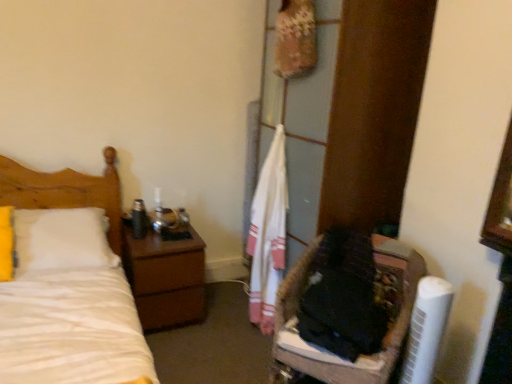
Question: From a real-world perspective, does brown wood nightstand at left sit lower than white matte bed at left?

Choices:
 (A) yes
 (B) no

Answer: (A)

Question: Are brown wood nightstand at left and white matte bed at left located far from each other?

Choices:
 (A) no
 (B) yes

Answer: (A)

Question: Can you confirm if brown wood nightstand at left is smaller than white matte bed at left?

Choices:
 (A) yes
 (B) no

Answer: (A)

Question: Is brown wood nightstand at left taller than white matte bed at left?

Choices:
 (A) yes
 (B) no

Answer: (B)

Question: From a real-world perspective, is brown wood nightstand at left over white matte bed at left?

Choices:
 (A) yes
 (B) no

Answer: (B)

Question: In terms of width, does brown wood nightstand at left look wider or thinner when compared to fuzzy fabric basket at lower right?

Choices:
 (A) wide
 (B) thin

Answer: (B)

Question: Choose the correct answer: Is brown wood nightstand at left inside fuzzy fabric basket at lower right or outside it?

Choices:
 (A) outside
 (B) inside

Answer: (A)

Question: From the image's perspective, is brown wood nightstand at left located above or below fuzzy fabric basket at lower right?

Choices:
 (A) above
 (B) below

Answer: (A)

Question: Considering the positions of brown wood nightstand at left and fuzzy fabric basket at lower right in the image, is brown wood nightstand at left taller or shorter than fuzzy fabric basket at lower right?

Choices:
 (A) short
 (B) tall

Answer: (A)

Question: Relative to brown wood nightstand at left, is white matte bed at left in front or behind?

Choices:
 (A) behind
 (B) front

Answer: (B)

Question: From a real-world perspective, is white matte bed at left positioned above or below brown wood nightstand at left?

Choices:
 (A) below
 (B) above

Answer: (B)

Question: Is point (20, 192) positioned closer to the camera than point (197, 289)?

Choices:
 (A) farther
 (B) closer

Answer: (B)

Question: From the image's perspective, is white matte bed at left located above or below brown wood nightstand at left?

Choices:
 (A) below
 (B) above

Answer: (B)

Question: Considering the positions of white plastic air conditioner at lower right and fuzzy fabric basket at lower right in the image, is white plastic air conditioner at lower right taller or shorter than fuzzy fabric basket at lower right?

Choices:
 (A) tall
 (B) short

Answer: (B)

Question: Is white plastic air conditioner at lower right wider or thinner than fuzzy fabric basket at lower right?

Choices:
 (A) wide
 (B) thin

Answer: (B)